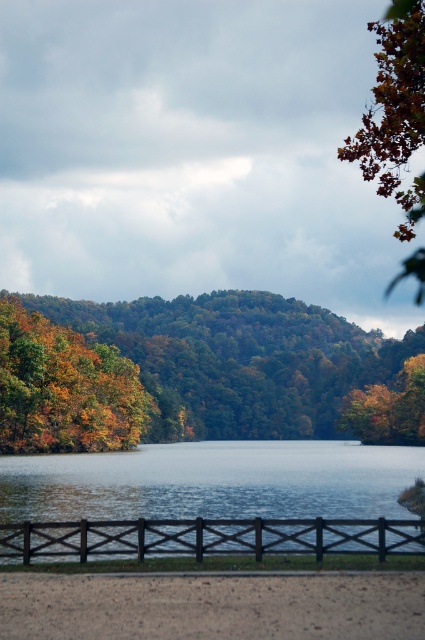
Question: Which of the following is the farthest from the observer?

Choices:
 (A) (124, 365)
 (B) (25, 561)
 (C) (156, 499)
 (D) (337, 380)

Answer: (D)

Question: Among these points, which one is nearest to the camera?

Choices:
 (A) (62, 532)
 (B) (37, 300)
 (C) (348, 141)

Answer: (A)

Question: Which point appears closest to the camera in this image?

Choices:
 (A) (416, 256)
 (B) (119, 532)

Answer: (B)

Question: Can you confirm if autumn leaves at left is positioned above black wood fence at lower center?

Choices:
 (A) yes
 (B) no

Answer: (A)

Question: Can you confirm if autumn leaves at left is positioned above black wood fence at lower center?

Choices:
 (A) yes
 (B) no

Answer: (A)

Question: Can you confirm if clear water at center is positioned to the left of autumn leaves at left?

Choices:
 (A) no
 (B) yes

Answer: (A)